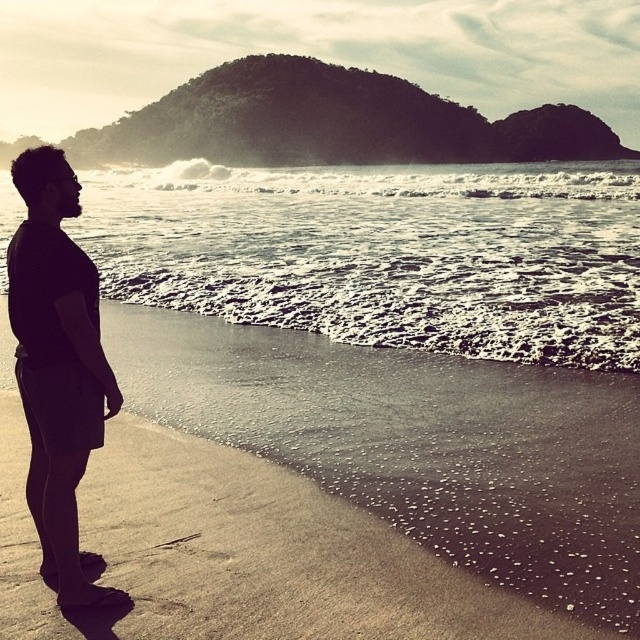
You are standing on the sandy beach at lower left and want to put on your black matte shorts at left. Can you reach them without moving from your current position?

The sandy beach at lower left is below the black matte shorts at left, so you can reach the black matte shorts at left from your current position on the sandy beach at lower left.

You are standing on the beach and see the white frothy water at center and the black matte shorts at left. Which object is closer to the right side of the scene?

The white frothy water at center is closer to the right side of the scene than the black matte shorts at left.

You are a photographer standing on the beach with your equipment. You want to capture a photo of the white frothy water at center and the black matte shorts at left in the same frame. Given that your camera has a maximum focus range of 15 meters, will you be able to capture both objects clearly in one shot?

The distance between the white frothy water at center and the black matte shorts at left is 14.80 meters, which is within the camera maximum focus range of 15 meters. Therefore, you can capture both objects clearly in one shot.